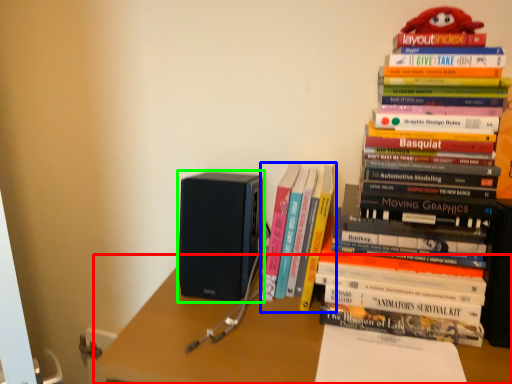
Question: Considering the real-world distances, which object is farthest from desk (highlighted by a red box)? book (highlighted by a blue box) or speaker (highlighted by a green box)?

Choices:
 (A) book
 (B) speaker

Answer: (A)